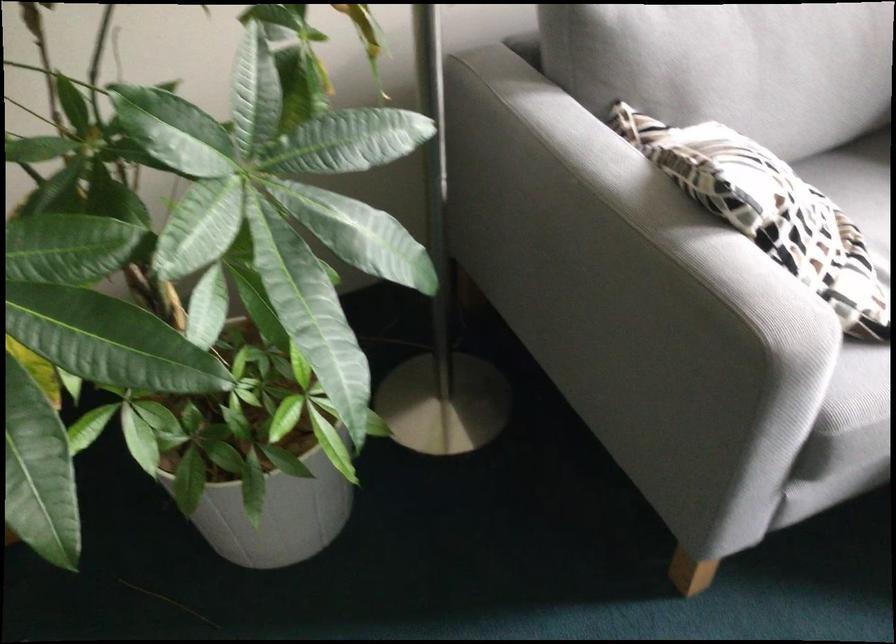
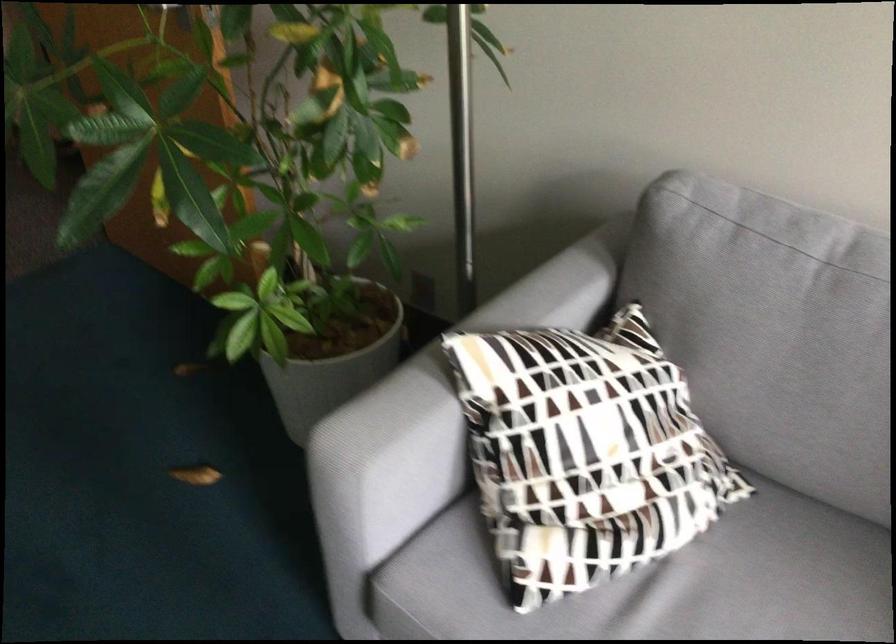
Find the pixel in the second image that matches pixel 759 252 in the first image.

(444, 397)